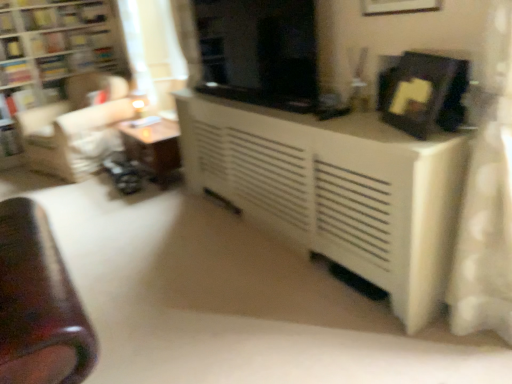
This screenshot has height=384, width=512. Identify the location of free space to the left of white matte cabinet at center, which is the 1th table in right-to-left order. (165, 250).